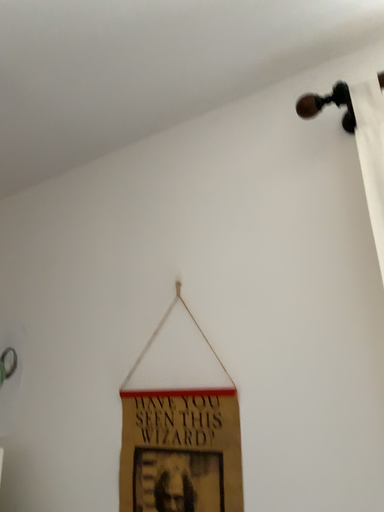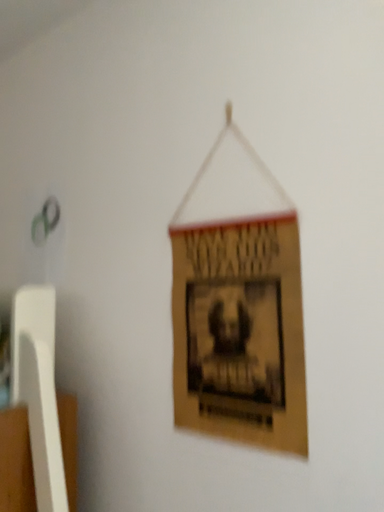
Question: How did the camera likely rotate when shooting the video?

Choices:
 (A) rotated upward
 (B) rotated downward

Answer: (B)